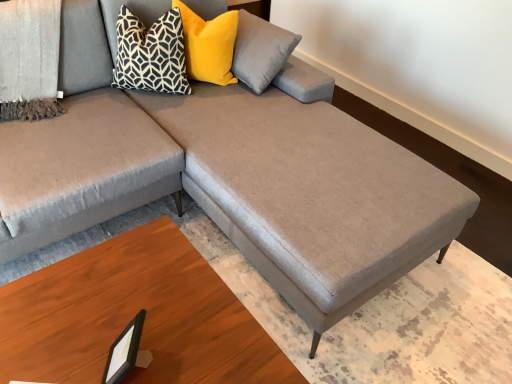
This screenshot has height=384, width=512. In order to click on vacant space to the right of black plastic picture frame at lower left in this screenshot , I will do `click(190, 353)`.